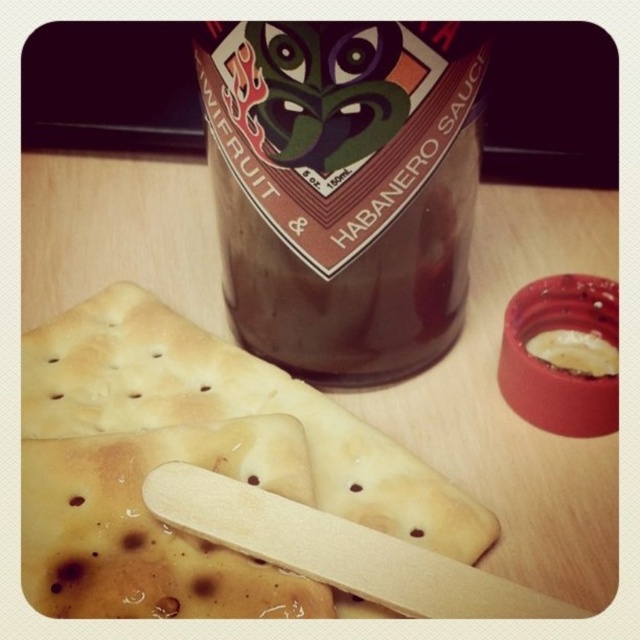
Does crusty white cracker at center appear on the left side of brown glass bottle at center?

Yes, crusty white cracker at center is to the left of brown glass bottle at center.

Is point (330, 451) positioned before point (275, 355)?

Yes.

Which is behind, point (474, 538) or point (476, 48)?

The point (474, 538) is more distant.

Identify the location of crusty white cracker at center. The image size is (640, 640). (193, 464).

Is crusty white cracker at center taller than yellowish creamy spread at upper right?

Yes, crusty white cracker at center is taller than yellowish creamy spread at upper right.

Is crusty white cracker at center below yellowish creamy spread at upper right?

Yes, crusty white cracker at center is below yellowish creamy spread at upper right.

Where is `crusty white cracker at center`? The image size is (640, 640). crusty white cracker at center is located at coordinates pyautogui.click(x=193, y=464).

Where is `crusty white cracker at center`? crusty white cracker at center is located at coordinates (193, 464).

Which is behind, point (339, 253) or point (580, 332)?

Positioned behind is point (580, 332).

From the picture: Who is more distant from viewer, [282,266] or [548,358]?

Point [548,358]

Identify the location of brown glass bottle at center. The height and width of the screenshot is (640, 640). (342, 188).